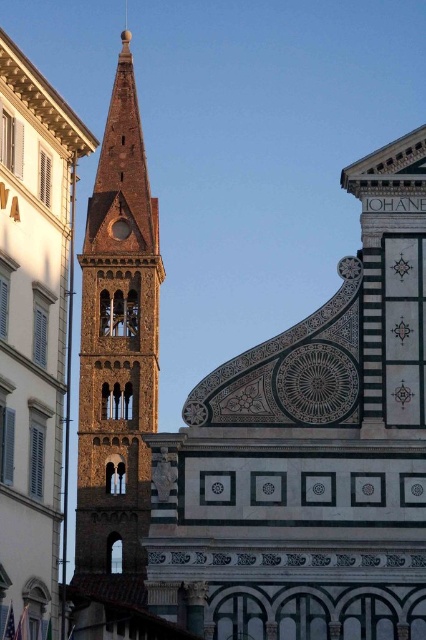
Question: Which point is closer to the camera taking this photo?

Choices:
 (A) (114, 524)
 (B) (17, 570)

Answer: (B)

Question: Does brown stone tower at center appear on the left side of brown textured tower at center?

Choices:
 (A) no
 (B) yes

Answer: (A)

Question: Which of the following is the farthest from the observer?

Choices:
 (A) brown stone tower at center
 (B) brown textured tower at center

Answer: (B)

Question: Does brown stone tower at center have a greater width compared to brown textured tower at center?

Choices:
 (A) no
 (B) yes

Answer: (A)

Question: Which point is closer to the camera?

Choices:
 (A) brown stone tower at center
 (B) brown textured tower at center

Answer: (A)

Question: Does brown stone tower at center lie in front of brown textured tower at center?

Choices:
 (A) no
 (B) yes

Answer: (B)